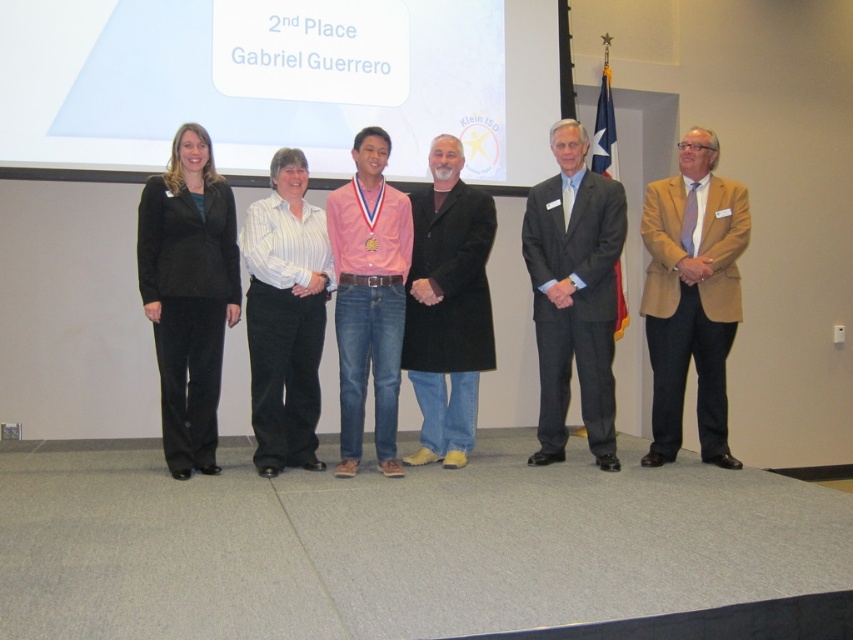
You are a photographer at the event and need to adjust the camera focus. Which of the black velvet pants at left or gray suit at center should you focus on first if you want to ensure the narrower object is in sharp detail?

The black velvet pants at left is narrower than the gray suit at center, so you should focus on the black velvet pants at left first to ensure the narrower object is in sharp detail.

You are a photographer at the event and need to ensure all attendees fit within the camera frame. The gray suit at center and the black wool coat at center are two individuals in the middle. Which one has a larger width in the image?

The gray suit at center might be wider than black wool coat at center, so the gray suit at center has a larger width in the image.

You are a photographer at the event and need to position a spotlight on the person wearing the white striped shirt at center. Since the spotlight can only illuminate objects within a 2 meter radius, will it also light up the person wearing the black velvet pants at left?

The black velvet pants at left is to the left of white striped shirt at center, so the distance between them is less than 2 meters. Therefore, the spotlight will also illuminate the person wearing the black velvet pants at left.